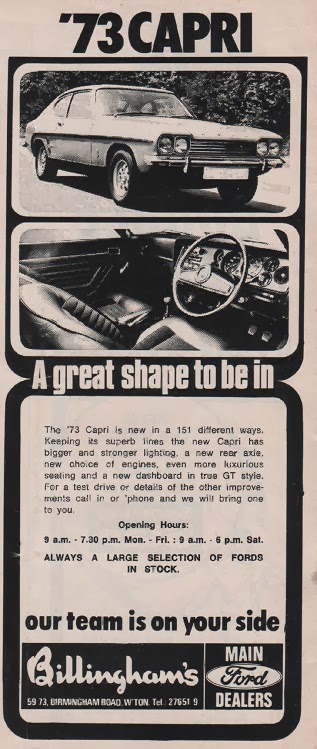
This screenshot has width=317, height=749. What are the coordinates of `seat` in the screenshot? It's located at (166, 333), (125, 302).